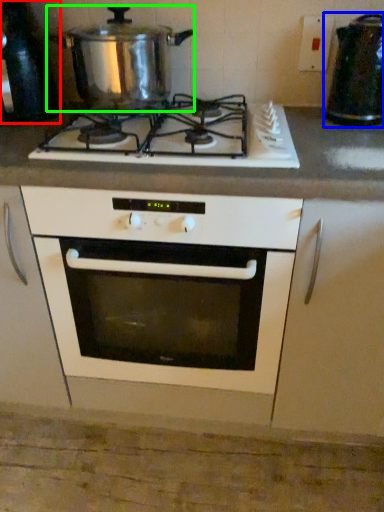
Question: Considering the real-world distances, which object is closest to appliance (highlighted by a red box)? appliance (highlighted by a blue box) or kitchen appliance (highlighted by a green box).

Choices:
 (A) appliance
 (B) kitchen appliance

Answer: (B)